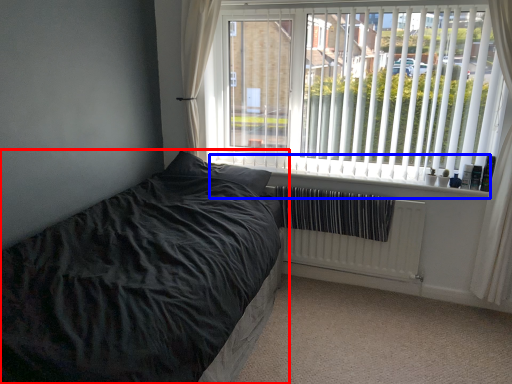
Question: Among these objects, which one is nearest to the camera, bed (highlighted by a red box) or window sill (highlighted by a blue box)?

Choices:
 (A) bed
 (B) window sill

Answer: (A)